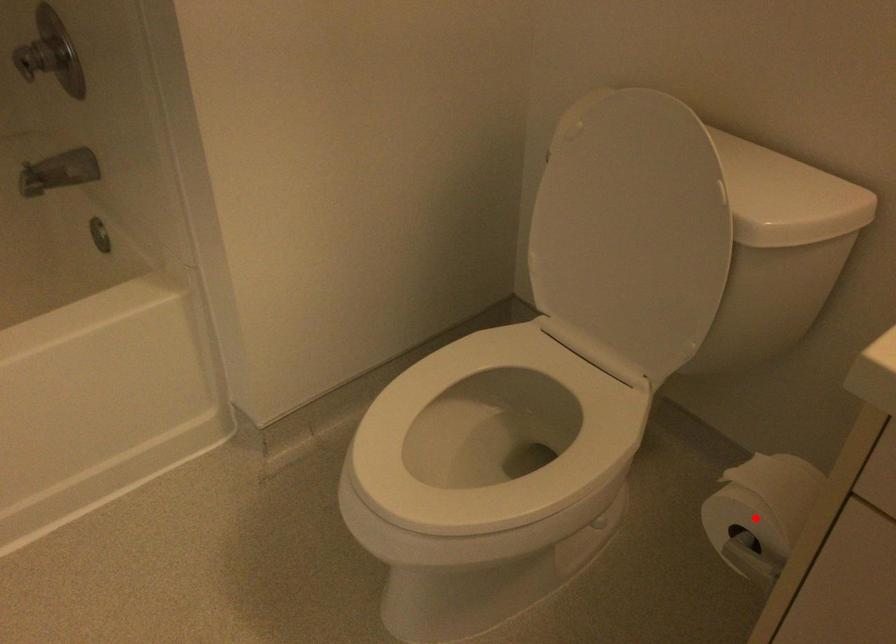
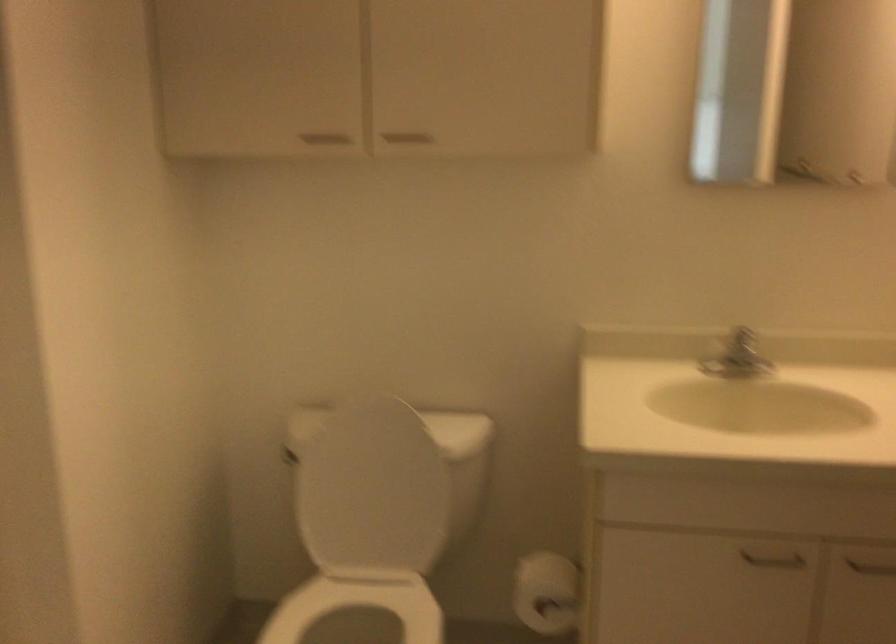
Question: I am providing you with two images of the same scene from different viewpoints. A red point is marked on the first image. Is the red point's position out of view in image 2?

Choices:
 (A) Yes
 (B) No

Answer: (B)